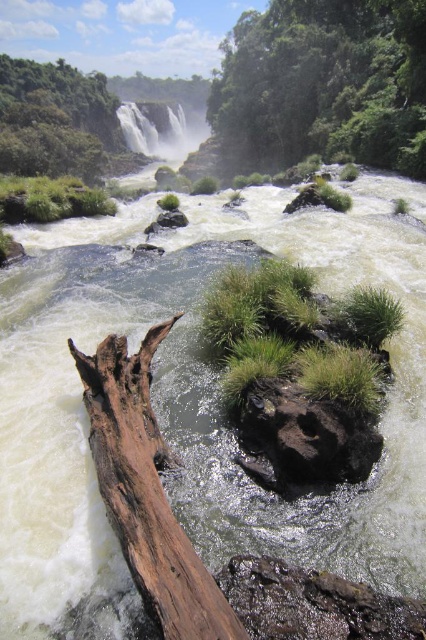
Which of these two, brown rough tree trunk at lower left or white textured water at upper center, stands shorter?

brown rough tree trunk at lower left is shorter.

In the scene shown: Which is above, brown rough tree trunk at lower left or white textured water at upper center?

Positioned higher is white textured water at upper center.

At what (x,y) coordinates should I click in order to perform the action: click on brown rough tree trunk at lower left. Please return your answer as a coordinate pair (x, y). This screenshot has height=640, width=426. Looking at the image, I should click on (146, 492).

Where is `brown rough tree trunk at lower left`? This screenshot has height=640, width=426. brown rough tree trunk at lower left is located at coordinates (146, 492).

Who is shorter, green leafy tree at upper center or black rough rock at center?

black rough rock at center

Is green leafy tree at upper center behind black rough rock at center?

Yes.

Between point (328, 51) and point (250, 426), which one is positioned behind?

Positioned behind is point (328, 51).

Find the location of a particular element. green leafy tree at upper center is located at coordinates (322, 84).

Consider the image. Does green leafy tree at upper center appear on the right side of green leafy tree at upper left?

Indeed, green leafy tree at upper center is positioned on the right side of green leafy tree at upper left.

Is green leafy tree at upper center bigger than green leafy tree at upper left?

Actually, green leafy tree at upper center might be smaller than green leafy tree at upper left.

Is point (316, 113) closer to viewer compared to point (14, 166)?

No.

I want to click on green leafy tree at upper center, so click(322, 84).